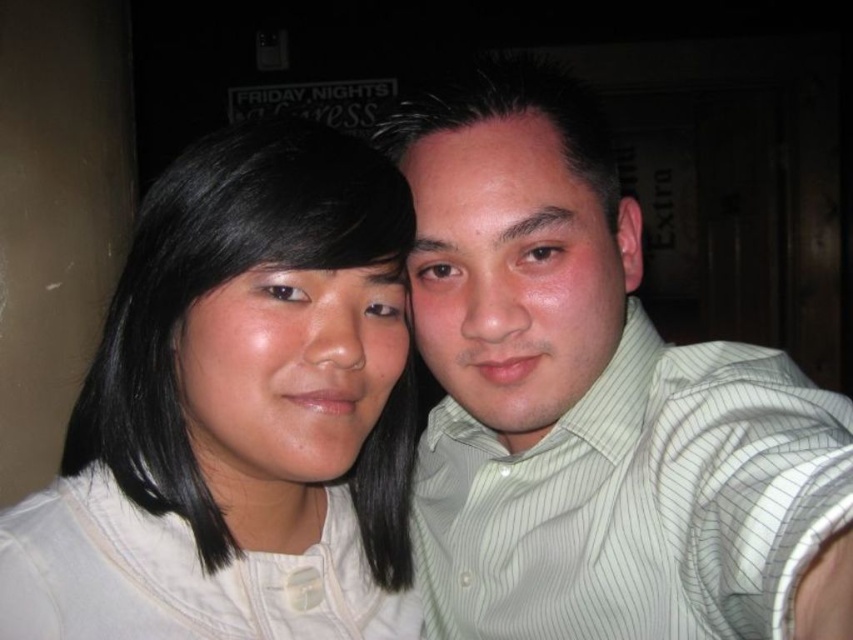
Question: Among these points, which one is nearest to the camera?

Choices:
 (A) (107, 616)
 (B) (215, 340)
 (C) (607, 221)
 (D) (525, 568)

Answer: (B)

Question: Estimate the real-world distances between objects in this image. Which object is closer to the white matte shirt at left?

Choices:
 (A) matte white face at center
 (B) matte green shirt at center

Answer: (A)

Question: Does matte green shirt at center have a lesser width compared to matte white face at center?

Choices:
 (A) no
 (B) yes

Answer: (A)

Question: Which point appears closest to the camera in this image?

Choices:
 (A) (692, 465)
 (B) (105, 497)
 (C) (552, 412)
 (D) (181, 358)

Answer: (A)

Question: Does white matte shirt at left appear on the right side of matte white face at center?

Choices:
 (A) no
 (B) yes

Answer: (A)

Question: From the image, what is the correct spatial relationship of green striped shirt at right in relation to matte green shirt at center?

Choices:
 (A) above
 (B) below

Answer: (B)